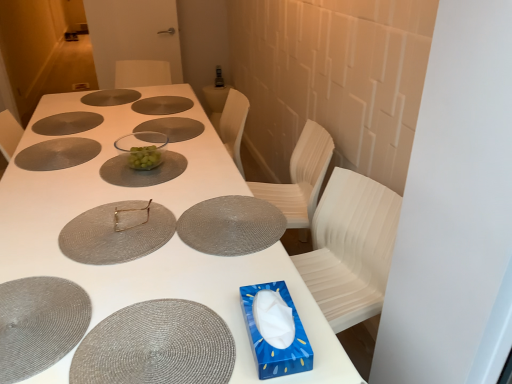
Where is `unoccupied area behind matte gray placemat at center, placed as the third glass plate when sorted from front to back`? The width and height of the screenshot is (512, 384). unoccupied area behind matte gray placemat at center, placed as the third glass plate when sorted from front to back is located at coordinates pyautogui.click(x=203, y=177).